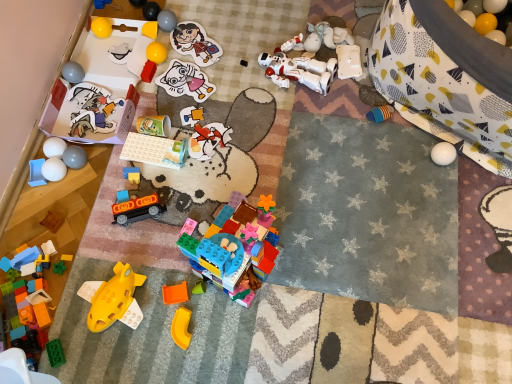
You are a GUI agent. You are given a task and a screenshot of the screen. Output one action in this format:
    pyautogui.click(x=<x>, y=<y>)
    Task: Click on the free location in front of white plastic remote control at upper center, the 24th toy when ordered from left to right
    The width and height of the screenshot is (512, 384).
    Given the screenshot: What is the action you would take?
    pyautogui.click(x=348, y=109)